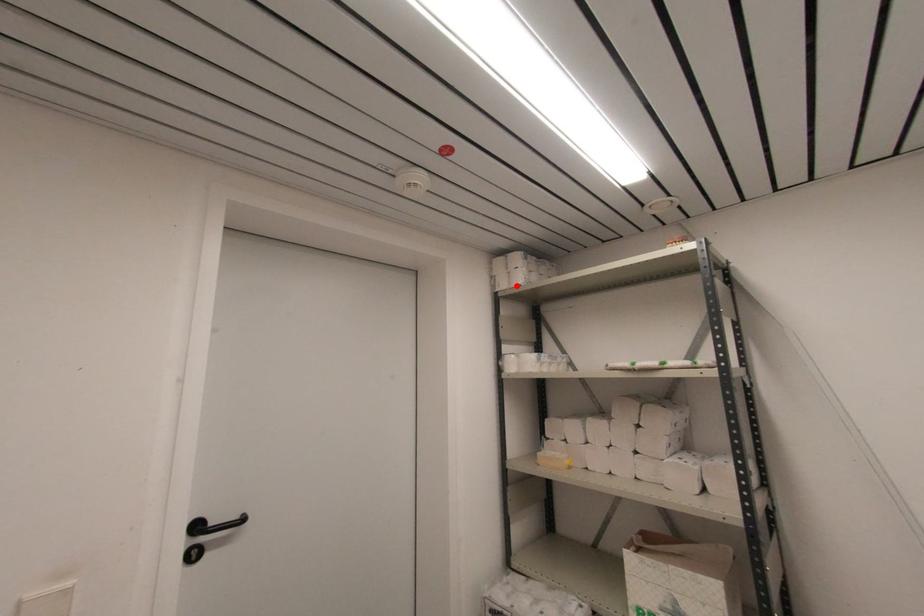
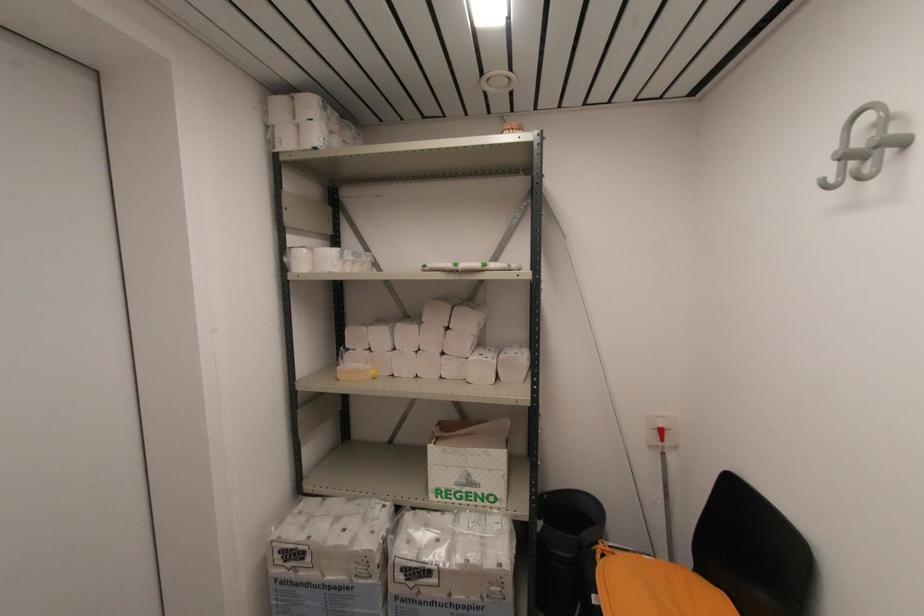
In the second image, find the point that corresponds to the highlighted location in the first image.

(310, 148)